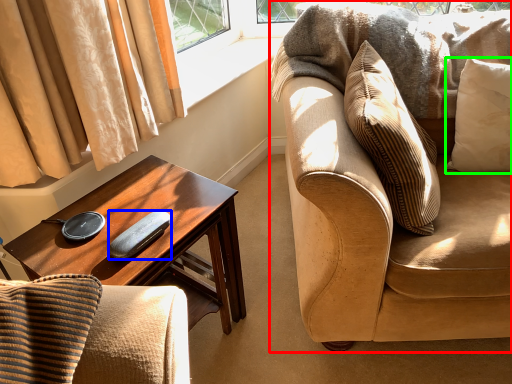
Question: Estimate the real-world distances between objects in this image. Which object is farther from studio couch (highlighted by a red box), remote control (highlighted by a blue box) or pillow (highlighted by a green box)?

Choices:
 (A) remote control
 (B) pillow

Answer: (A)